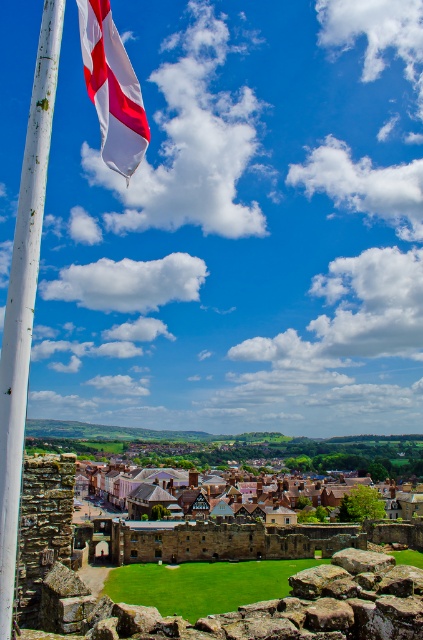
You are a photographer positioned at the base of the historic stone structure. You want to capture a photo of the white matte flag at upper left. Given that your camera has a maximum focus range of 30 meters, will you be able to clearly capture the flag in your photo?

The white matte flag at upper left is 32.23 meters away from the camera. Since the camera can only focus up to 30 meters, it will not be able to clearly capture the flag in the photo.